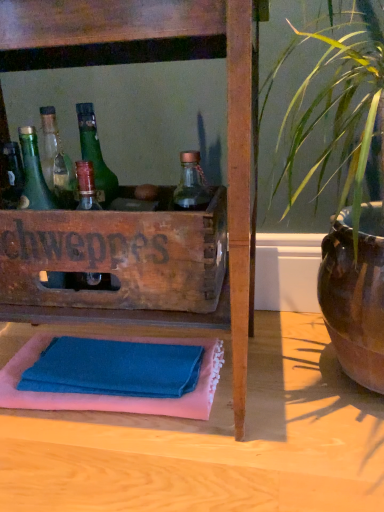
Question: Should I look upward or downward to see green glass bottle at left?

Choices:
 (A) up
 (B) down

Answer: (A)

Question: Is there a large distance between green glass bottle at left and wooden crate at center?

Choices:
 (A) no
 (B) yes

Answer: (A)

Question: Is green glass bottle at left not within wooden crate at center?

Choices:
 (A) no
 (B) yes

Answer: (A)

Question: Could you tell me if green glass bottle at left is facing wooden crate at center?

Choices:
 (A) yes
 (B) no

Answer: (A)

Question: Does green glass bottle at left appear on the left side of wooden crate at center?

Choices:
 (A) no
 (B) yes

Answer: (B)

Question: Is green glass bottle at left in contact with wooden crate at center?

Choices:
 (A) no
 (B) yes

Answer: (A)

Question: Is green glass bottle at left shorter than wooden crate at center?

Choices:
 (A) no
 (B) yes

Answer: (B)

Question: From a real-world perspective, is blue cotton bath towel at lower center located beneath wooden crate at center?

Choices:
 (A) no
 (B) yes

Answer: (B)

Question: Can you confirm if blue cotton bath towel at lower center is wider than wooden crate at center?

Choices:
 (A) yes
 (B) no

Answer: (B)

Question: From the image's perspective, does blue cotton bath towel at lower center appear higher than wooden crate at center?

Choices:
 (A) no
 (B) yes

Answer: (A)

Question: From the image's perspective, would you say blue cotton bath towel at lower center is shown under wooden crate at center?

Choices:
 (A) yes
 (B) no

Answer: (A)

Question: Is blue cotton bath towel at lower center aimed at wooden crate at center?

Choices:
 (A) no
 (B) yes

Answer: (A)

Question: Considering the relative positions of blue cotton bath towel at lower center and wooden crate at center in the image provided, is blue cotton bath towel at lower center to the right of wooden crate at center from the viewer's perspective?

Choices:
 (A) yes
 (B) no

Answer: (A)

Question: From a real-world perspective, is wooden crate at center located higher than blue cotton bath towel at lower center?

Choices:
 (A) no
 (B) yes

Answer: (B)